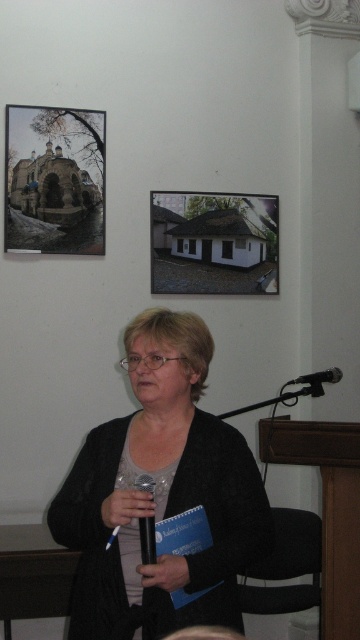
Question: Considering the real-world distances, which object is closest to the black metallic microphone at center?

Choices:
 (A) black matte cardigan at center
 (B) white matte house at upper center

Answer: (A)

Question: Observing the image, what is the correct spatial positioning of black matte cardigan at center in reference to matte black church at upper left?

Choices:
 (A) left
 (B) right

Answer: (B)

Question: Which object is farther from the camera taking this photo?

Choices:
 (A) white matte house at upper center
 (B) black metallic microphone at lower right
 (C) matte black church at upper left
 (D) black metallic microphone at center

Answer: (A)

Question: Which point appears closest to the camera in this image?

Choices:
 (A) (322, 371)
 (B) (75, 580)
 (C) (56, 129)
 (D) (137, 486)

Answer: (D)

Question: Is matte black church at upper left smaller than black metallic microphone at lower right?

Choices:
 (A) yes
 (B) no

Answer: (B)

Question: Observing the image, what is the correct spatial positioning of black metallic microphone at center in reference to black metallic microphone at lower right?

Choices:
 (A) left
 (B) right

Answer: (A)